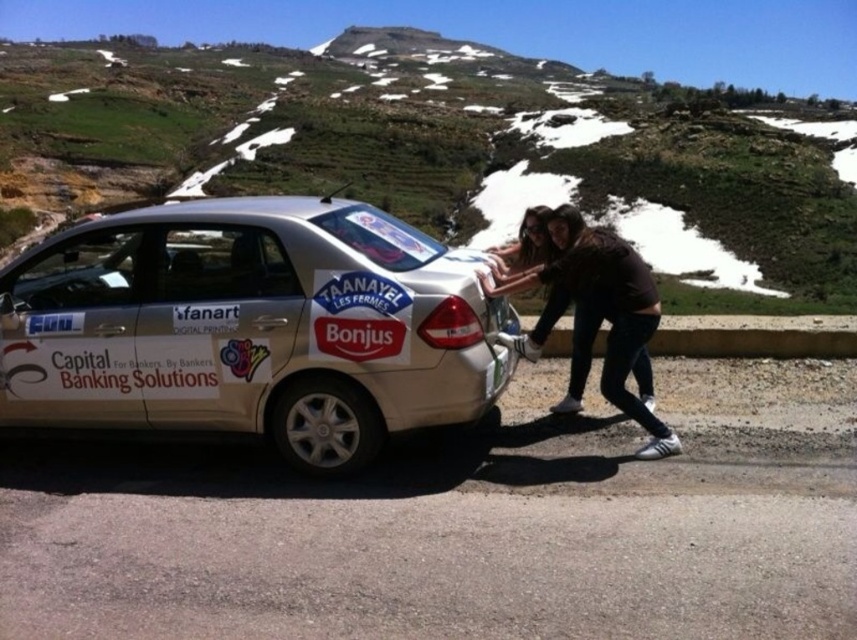
Question: Can you confirm if gold metallic car at center is thinner than dark brown leather jacket at center?

Choices:
 (A) no
 (B) yes

Answer: (A)

Question: Can you confirm if gold metallic car at center is positioned below dark brown leather jacket at center?

Choices:
 (A) no
 (B) yes

Answer: (A)

Question: Which object is farther from the camera taking this photo?

Choices:
 (A) gold metallic car at center
 (B) dark brown leather jacket at center

Answer: (B)

Question: Is gold metallic car at center to the right of dark brown leather jacket at center from the viewer's perspective?

Choices:
 (A) no
 (B) yes

Answer: (A)